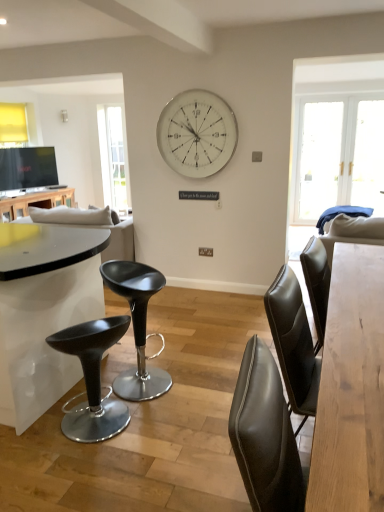
Question: Is matte black stool at center with white glossy table at left, which ranks as the second table in front-to-back order?

Choices:
 (A) no
 (B) yes

Answer: (A)

Question: Is matte black stool at center thinner than white glossy table at left, the 2th table when ordered from right to left?

Choices:
 (A) yes
 (B) no

Answer: (A)

Question: Considering the relative sizes of matte black stool at center and white glossy table at left, marked as the second table in a bottom-to-top arrangement, in the image provided, is matte black stool at center taller than white glossy table at left, marked as the second table in a bottom-to-top arrangement,?

Choices:
 (A) no
 (B) yes

Answer: (B)

Question: Considering the relative sizes of matte black stool at center and white glossy table at left, the 1th table viewed from the back, in the image provided, is matte black stool at center bigger than white glossy table at left, the 1th table viewed from the back,?

Choices:
 (A) yes
 (B) no

Answer: (B)

Question: Can you confirm if matte black stool at center is positioned to the right of white glossy table at left, the 2th table when ordered from right to left?

Choices:
 (A) no
 (B) yes

Answer: (B)

Question: Considering the positions of white metallic wall clock at upper center and white glossy table at left, the 1th table viewed from the back, in the image, is white metallic wall clock at upper center taller or shorter than white glossy table at left, the 1th table viewed from the back,?

Choices:
 (A) short
 (B) tall

Answer: (B)

Question: From the image's perspective, is white metallic wall clock at upper center located above or below white glossy table at left, the 2th table when ordered from right to left?

Choices:
 (A) below
 (B) above

Answer: (B)

Question: Looking at their shapes, would you say white metallic wall clock at upper center is wider or thinner than white glossy table at left, which is counted as the first table, starting from the left?

Choices:
 (A) wide
 (B) thin

Answer: (B)

Question: In the image, is white metallic wall clock at upper center positioned in front of or behind white glossy table at left, the 2th table when ordered from right to left?

Choices:
 (A) behind
 (B) front

Answer: (B)

Question: Is matte black stool at lower left in front of or behind white glossy table at left, the first table viewed from the top, in the image?

Choices:
 (A) front
 (B) behind

Answer: (A)

Question: From the image's perspective, is matte black stool at lower left located above or below white glossy table at left, the 1th table viewed from the back?

Choices:
 (A) above
 (B) below

Answer: (B)

Question: Choose the correct answer: Is matte black stool at lower left inside white glossy table at left, the 1th table viewed from the back, or outside it?

Choices:
 (A) inside
 (B) outside

Answer: (B)

Question: Is matte black stool at lower left to the left or to the right of white glossy table at left, the 2th table when ordered from right to left, in the image?

Choices:
 (A) left
 (B) right

Answer: (B)

Question: From the image's perspective, is matte black stool at center above or below clear glass window at left?

Choices:
 (A) above
 (B) below

Answer: (B)

Question: From a real-world perspective, relative to clear glass window at left, is matte black stool at center vertically above or below?

Choices:
 (A) below
 (B) above

Answer: (A)